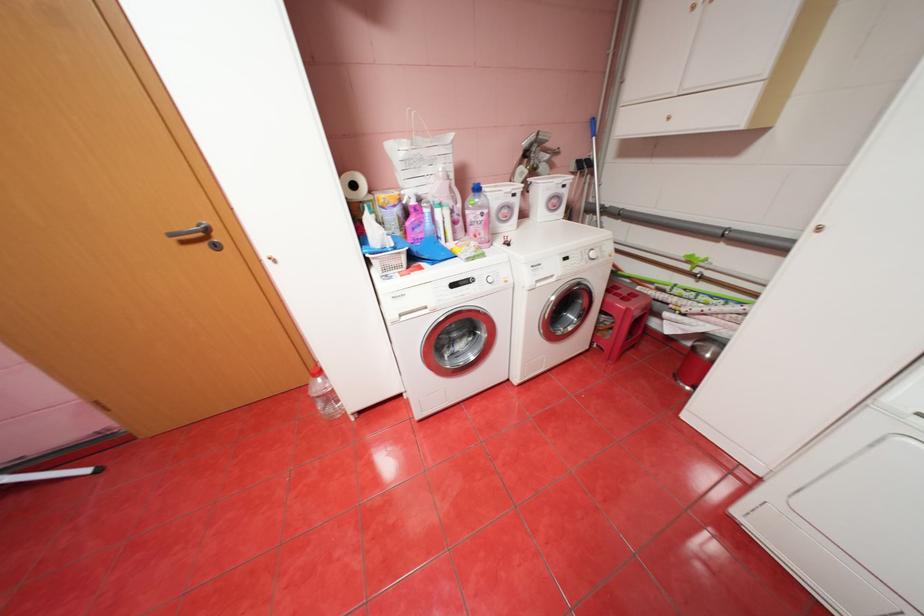
Where would you pull the recessed appliance handle? Please return your answer as a coordinate pair (x, y).

(197, 236)